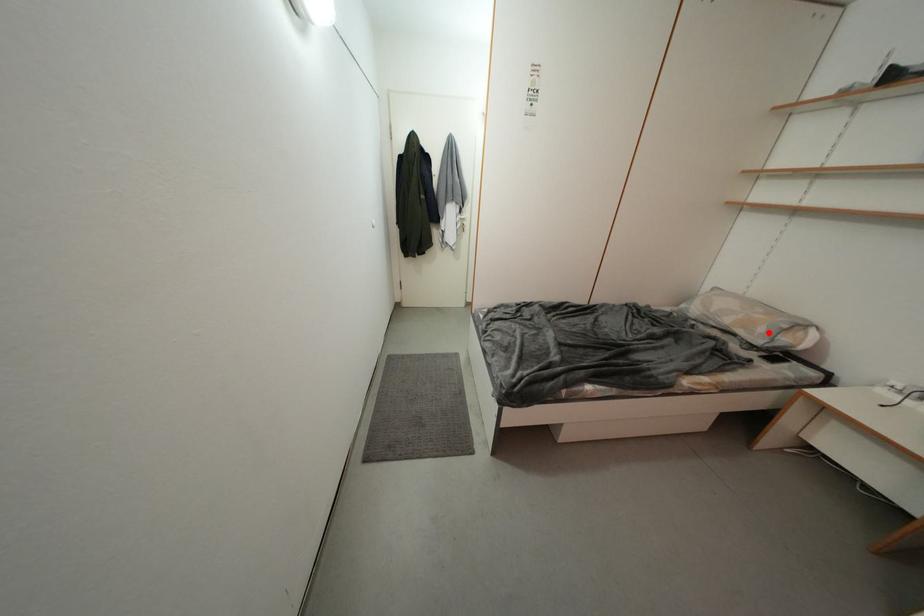
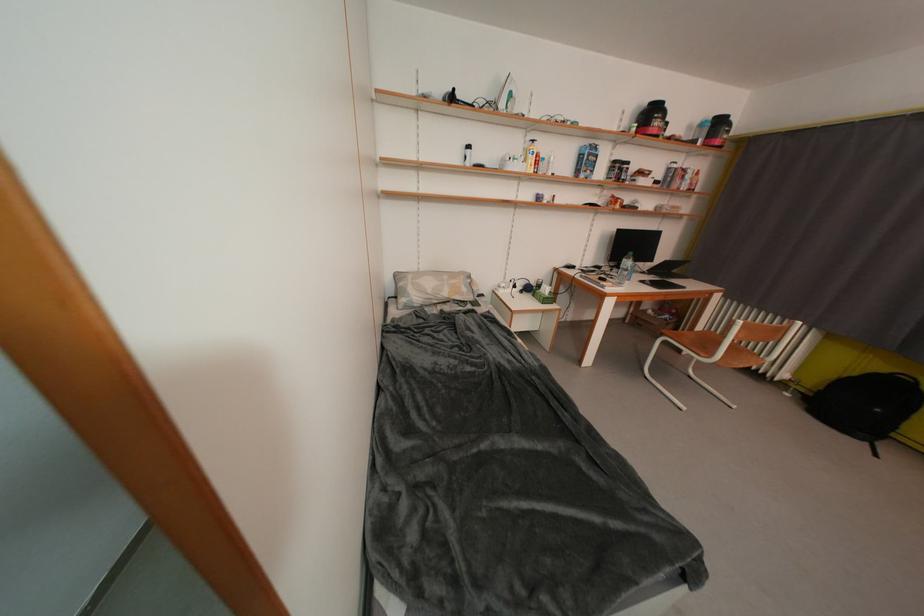
Locate, in the second image, the point that corresponds to the highlighted location in the first image.

(471, 293)